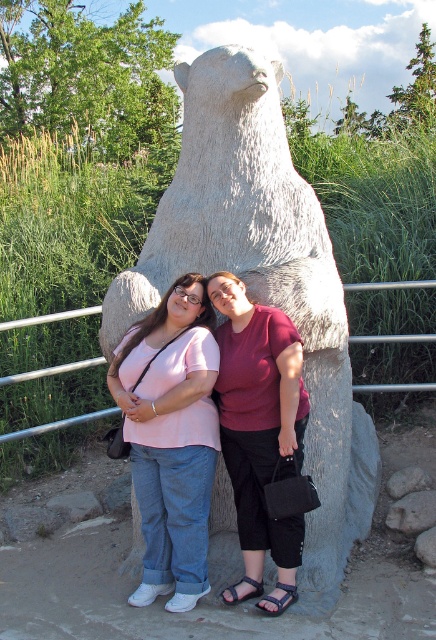
Question: Which point appears closest to the camera in this image?

Choices:
 (A) 242,589
 (B) 330,326

Answer: (A)

Question: Is white stone bear at center wider than matte red shirt at center?

Choices:
 (A) yes
 (B) no

Answer: (A)

Question: Which of these objects is positioned closest to the matte pink shirt at center?

Choices:
 (A) metal/rail at upper center
 (B) matte red shirt at center

Answer: (B)

Question: Is matte pink shirt at center in front of metal/rail at upper center?

Choices:
 (A) no
 (B) yes

Answer: (B)

Question: Where is matte red shirt at center located in relation to metal/rail at upper center in the image?

Choices:
 (A) below
 (B) above

Answer: (B)

Question: Based on their relative distances, which object is farther from the white stone bear at center?

Choices:
 (A) matte red shirt at center
 (B) matte pink shirt at center
 (C) metal/rail at upper center

Answer: (C)